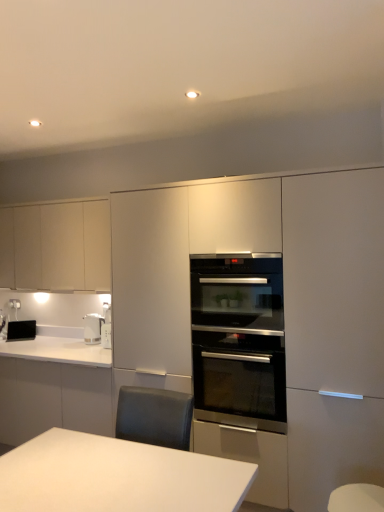
Question: Which is correct: matte white oven at center, which is counted as the 2th cabinetry, starting from the left, is inside white glossy countertop at lower left, or outside of it?

Choices:
 (A) inside
 (B) outside

Answer: (B)

Question: Considering their positions, is matte white oven at center, the first cabinetry when ordered from right to left, located in front of or behind white glossy countertop at lower left?

Choices:
 (A) front
 (B) behind

Answer: (A)

Question: Which object is positioned farthest from the stainless steel oven at center?

Choices:
 (A) stainless steel oven at center
 (B) black glossy toaster at lower left
 (C) white glossy countertop at lower left
 (D) matte white cabinets at left, marked as the first cabinetry in a back-to-front arrangement
 (E) white glossy electric kettle at left

Answer: (B)

Question: Which of these objects is positioned closest to the stainless steel oven at center?

Choices:
 (A) stainless steel oven at center
 (B) black glossy toaster at lower left
 (C) white glossy countertop at lower left
 (D) matte white oven at center, the first cabinetry viewed from the front
 (E) matte white cabinets at left, the 2th cabinetry when ordered from right to left

Answer: (A)